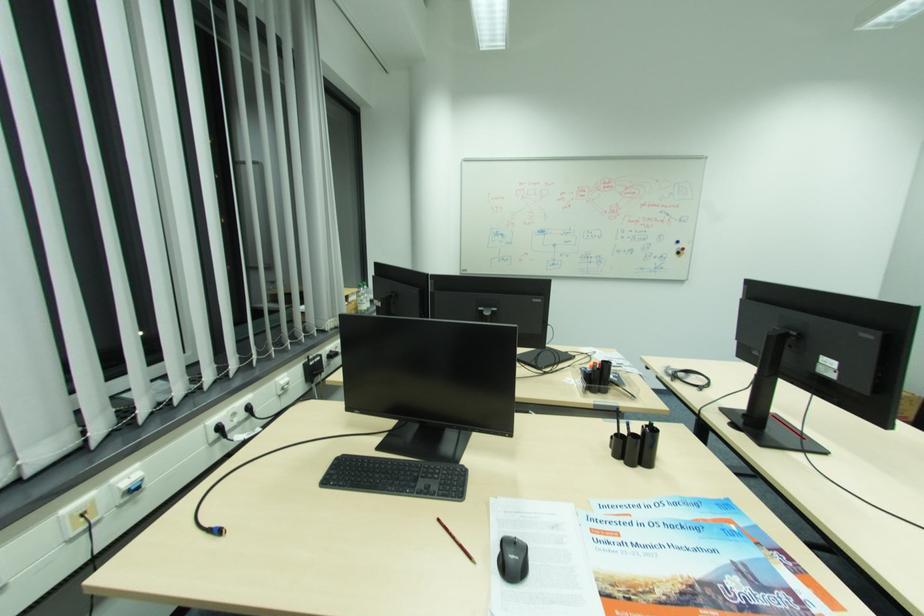
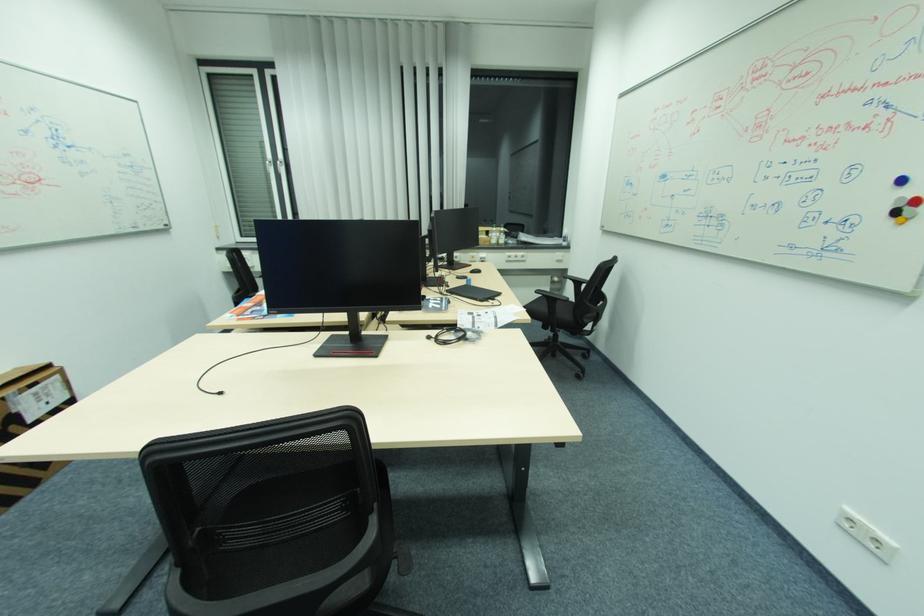
Locate, in the second image, the point that corresponds to pixel 686 251 in the first image.

(907, 206)